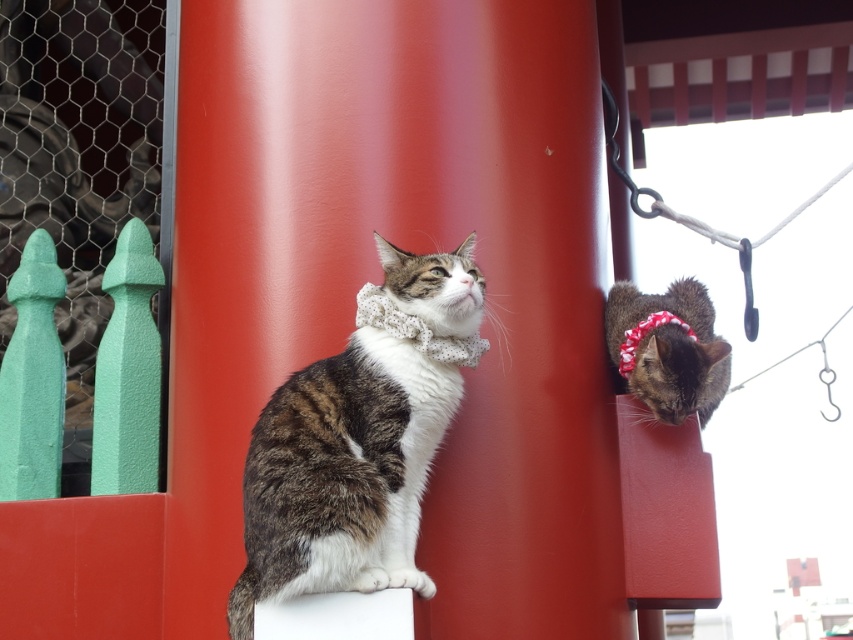
You are a photographer trying to capture both cats in a single frame. Given that the tabby fur cat at center is wider than the tabby fur cat at upper right, which cat should you focus on to ensure both are fully visible in your shot?

To ensure both the tabby fur cat at center and the tabby fur cat at upper right are fully visible, focus on the tabby fur cat at center since it is wider and likely closer to the camera, allowing the smaller cat at upper right to fit within the frame.

Based on the scene described, which object is taller between the smooth red pillar at center and the tabby fur cat at center?

The smooth red pillar at center is taller than the tabby fur cat at center according to the description.